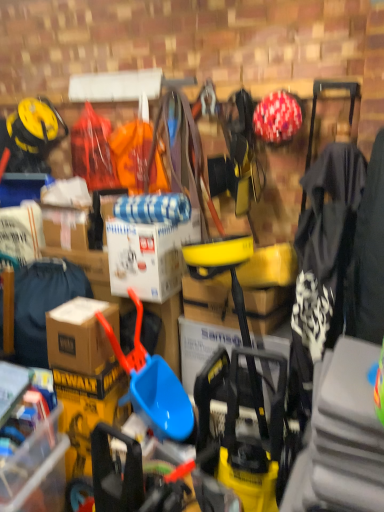
Question: Would you say black fabric jacket at right, marked as the second clothing in a back-to-front arrangement, is to the left or to the right of brown cardboard box at lower left in the picture?

Choices:
 (A) left
 (B) right

Answer: (B)

Question: In terms of width, does black fabric jacket at right, marked as the second clothing in a back-to-front arrangement, look wider or thinner when compared to brown cardboard box at lower left?

Choices:
 (A) wide
 (B) thin

Answer: (A)

Question: Estimate the real-world distances between objects in this image. Which object is closer to the black fabric jacket at right, placed as the second clothing when sorted from left to right?

Choices:
 (A) brown cardboard box at lower left
 (B) blue plastic shovel at center
 (C) brown cardboard box at left, which is the first clothing from back to front
 (D) white matte cardboard box at center
 (E) brown cardboard box at lower left

Answer: (D)

Question: Estimate the real-world distances between objects in this image. Which object is closer to the blue plastic shovel at center?

Choices:
 (A) brown cardboard box at left, the 2th clothing in the right-to-left sequence
 (B) brown cardboard box at lower left
 (C) black fabric jacket at right, marked as the second clothing in a back-to-front arrangement
 (D) brown cardboard box at lower left
 (E) white matte cardboard box at center

Answer: (B)